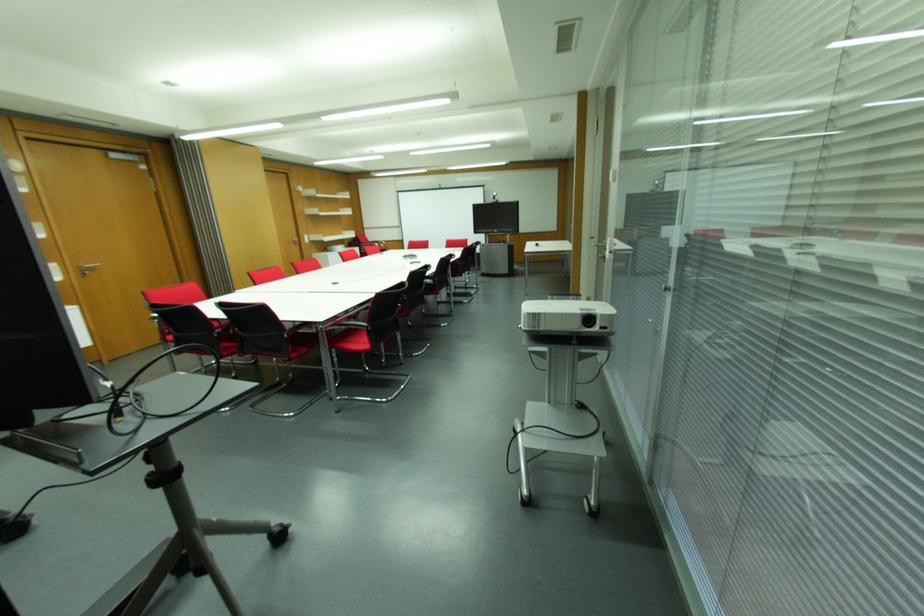
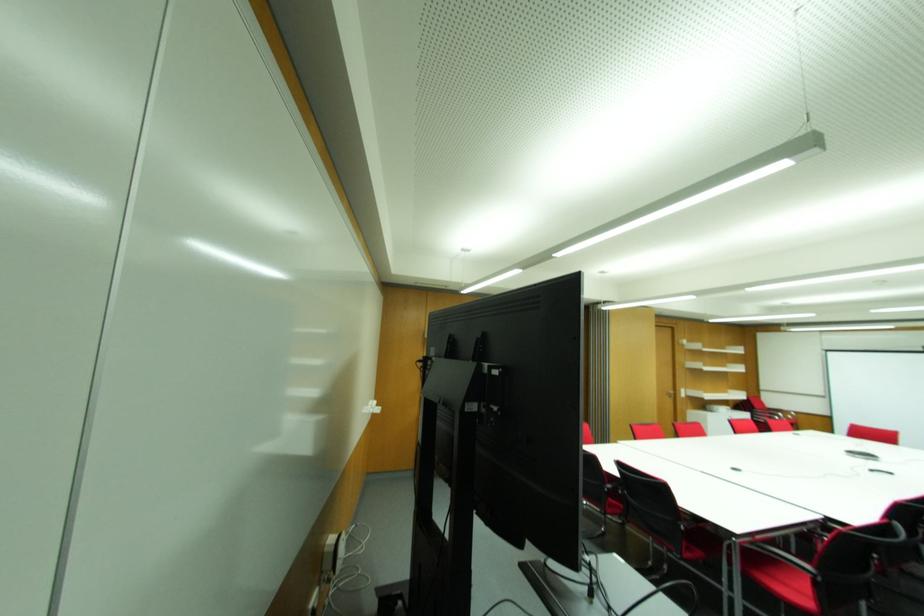
In the second image, find the point that corresponds to point 298,241 in the first image.

(675, 394)